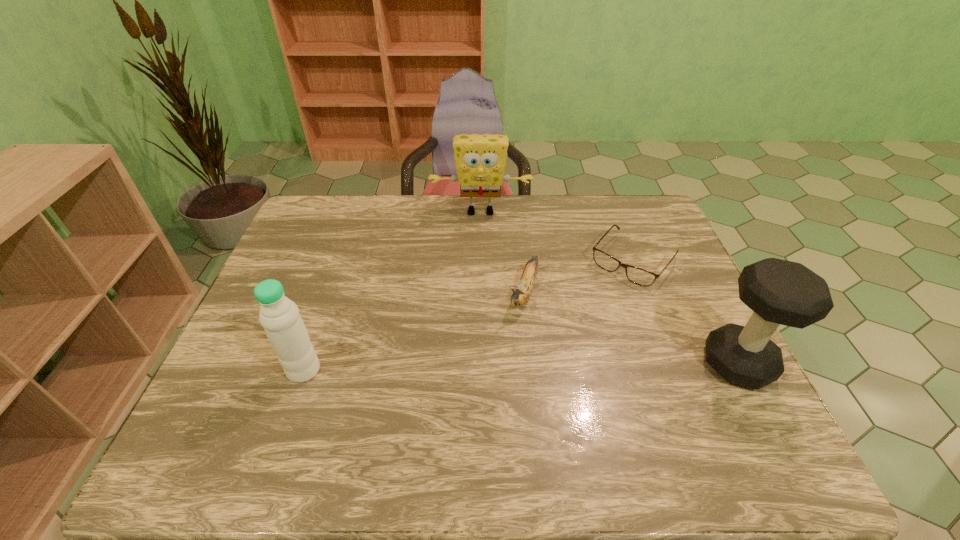
I want to click on free space on the desktop that is between the water bottle and the dumbbell and is positioned on the lenses of the shortest object, so click(x=546, y=367).

What are the coordinates of `free space on the desktop that is between the water bottle and the dumbbell and is positioned on the face of the sponge` in the screenshot? It's located at (480, 367).

You are a GUI agent. You are given a task and a screenshot of the screen. Output one action in this format:
    pyautogui.click(x=<x>, y=<y>)
    Task: Click on the vacant space on the desktop that is between the water bottle and the dumbbell and is positioned on the peel of the second shortest object
    
    Given the screenshot: What is the action you would take?
    pyautogui.click(x=491, y=367)